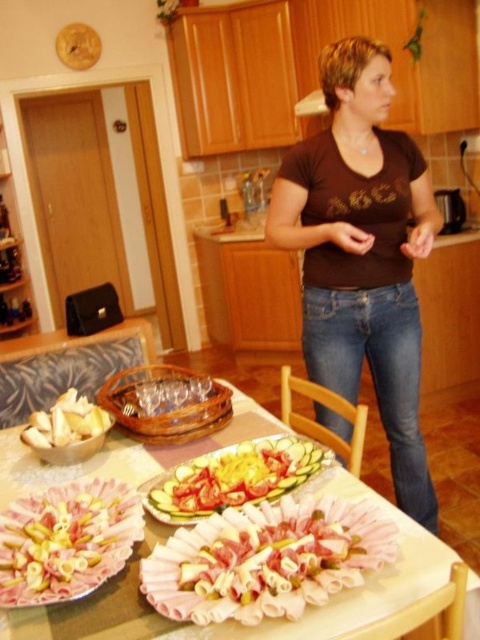
Question: Does brown cotton shirt at center lie in front of pink rolled meat at center?

Choices:
 (A) no
 (B) yes

Answer: (A)

Question: Which point is closer to the camera taking this photo?

Choices:
 (A) (131, 513)
 (B) (322, 147)

Answer: (A)

Question: Does pink rolled meat at center appear on the right side of white crumbly at lower left?

Choices:
 (A) no
 (B) yes

Answer: (B)

Question: Does pink paper plate at center appear under smooth white platter at center?

Choices:
 (A) no
 (B) yes

Answer: (B)

Question: Which point appears closest to the camera in this image?

Choices:
 (A) (92, 432)
 (B) (86, 518)
 (C) (383, 266)
 (D) (249, 404)

Answer: (B)

Question: Which point appears farthest from the camera in this image?

Choices:
 (A) (294, 502)
 (B) (111, 497)

Answer: (B)